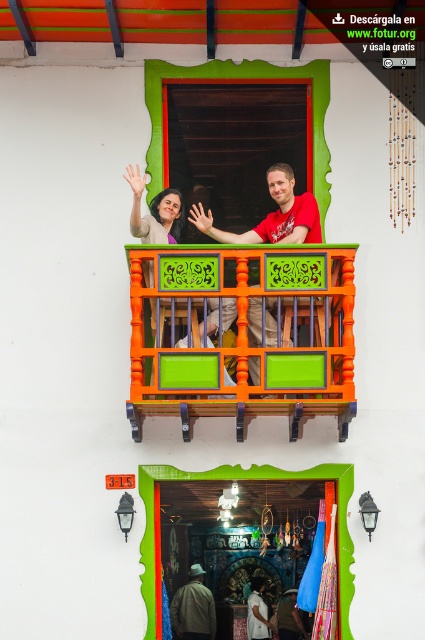
Question: Does orange painted wood balcony at center appear on the right side of green painted wooden door at center?

Choices:
 (A) yes
 (B) no

Answer: (A)

Question: Can you confirm if red matte shirt at center is positioned to the left of matte purple blouse at upper center?

Choices:
 (A) no
 (B) yes

Answer: (A)

Question: Among these objects, which one is nearest to the camera?

Choices:
 (A) red matte shirt at center
 (B) orange painted wood balcony at center
 (C) dark brown leather jacket at center
 (D) matte black shirt at center

Answer: (B)

Question: Does green painted wooden door at center have a smaller size compared to matte purple blouse at upper center?

Choices:
 (A) yes
 (B) no

Answer: (B)

Question: Estimate the real-world distances between objects in this image. Which object is farther from the green painted wooden door at center?

Choices:
 (A) orange painted wood balcony at center
 (B) matte purple blouse at upper center
 (C) matte black shirt at center

Answer: (C)

Question: Which object is the closest to the orange painted wood balcony at center?

Choices:
 (A) matte black shirt at center
 (B) green painted wooden door at center
 (C) matte purple blouse at upper center

Answer: (B)